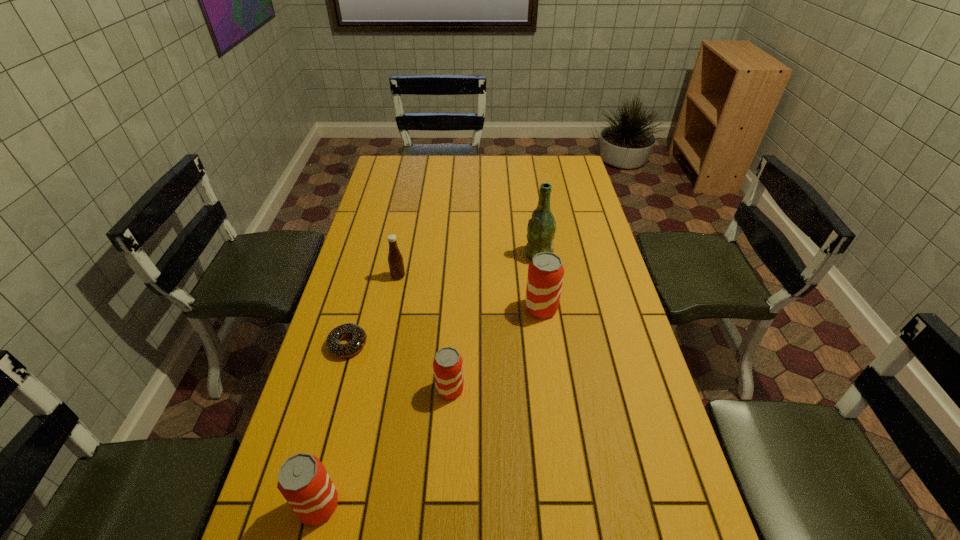
Locate an element on the screen. The height and width of the screenshot is (540, 960). free spot between the doughnut and the third object from right to left is located at coordinates (398, 367).

Locate an element on the screen. The height and width of the screenshot is (540, 960). vacant space in between the farthest object and the leftmost beer can is located at coordinates (428, 380).

Locate an element on the screen. vacant area between the fifth nearest object and the fourth nearest object is located at coordinates (469, 292).

You are a GUI agent. You are given a task and a screenshot of the screen. Output one action in this format:
    pyautogui.click(x=<x>, y=<y>)
    Task: Click on the free space between the shortest object and the nearest beer can
    This screenshot has height=540, width=960.
    Given the screenshot: What is the action you would take?
    pyautogui.click(x=333, y=425)

At what (x,y) coordinates should I click in order to perform the action: click on vacant area between the third nearest object and the fifth farthest object. Please return your answer as a coordinate pair (x, y). The height and width of the screenshot is (540, 960). Looking at the image, I should click on (398, 367).

The height and width of the screenshot is (540, 960). I want to click on free point between the second beer can from right to left and the fourth farthest object, so click(x=398, y=367).

Image resolution: width=960 pixels, height=540 pixels. I want to click on free space between the nearest beer can and the tallest object, so click(428, 380).

This screenshot has width=960, height=540. In order to click on empty space that is in between the nearest object and the fifth nearest object in this screenshot , I will do `click(358, 391)`.

Find the location of a particular element. The image size is (960, 540). vacant space that's between the third object from left to right and the second nearest object is located at coordinates (424, 333).

You are a GUI agent. You are given a task and a screenshot of the screen. Output one action in this format:
    pyautogui.click(x=<x>, y=<y>)
    Task: Click on the object identified as the fifth closest to the beer bottle
    This screenshot has width=960, height=540.
    Given the screenshot: What is the action you would take?
    pyautogui.click(x=303, y=480)